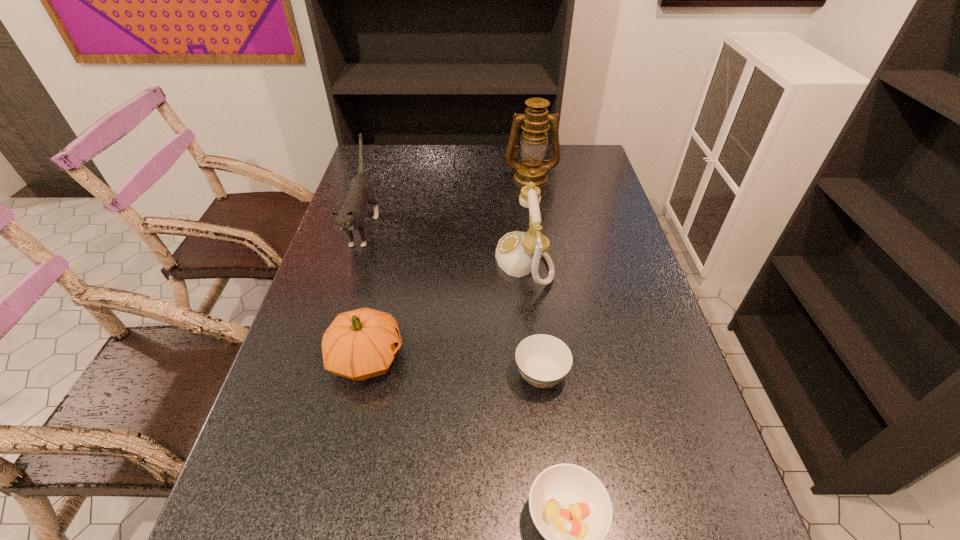
Locate an element on the screen. the tallest object is located at coordinates (535, 122).

Identify the location of oil lamp. Image resolution: width=960 pixels, height=540 pixels. (535, 122).

Locate an element on the screen. This screenshot has width=960, height=540. cat is located at coordinates (350, 217).

Where is `the fourth shortest object`? Image resolution: width=960 pixels, height=540 pixels. the fourth shortest object is located at coordinates (518, 253).

The image size is (960, 540). What are the coordinates of `gourd` in the screenshot? It's located at (359, 344).

This screenshot has width=960, height=540. What are the coordinates of `the farther soup bowl` in the screenshot? It's located at (543, 360).

At what (x,y) coordinates should I click in order to perform the action: click on free region located 0.060m on the back of the farthest object. Please return your answer as a coordinate pair (x, y). The width and height of the screenshot is (960, 540). Looking at the image, I should click on 528,160.

Identify the location of vacant space located 0.280m at the face of the fifth shortest object. (327, 343).

The height and width of the screenshot is (540, 960). I want to click on free space located 0.360m on the dial of the third tallest object, so click(370, 260).

Locate an element on the screen. vacant space located 0.250m on the dial of the third tallest object is located at coordinates (408, 260).